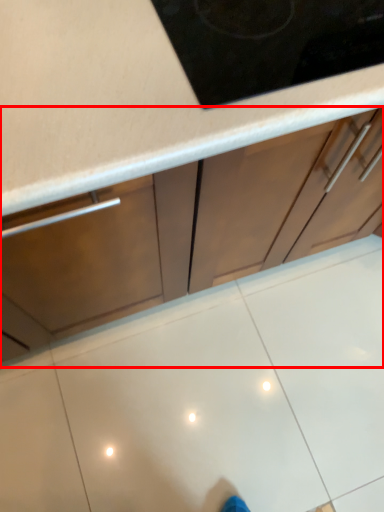
Question: From the image's perspective, what is the correct spatial positioning of cabinetry (annotated by the red box) in reference to tile?

Choices:
 (A) above
 (B) below

Answer: (A)